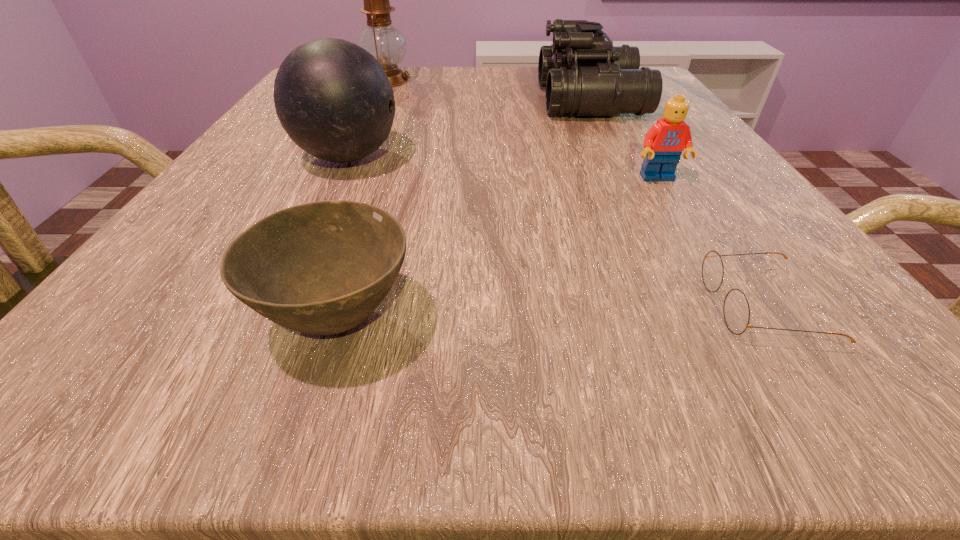
Identify the location of free space between the tallest object and the shortest object. (574, 193).

This screenshot has width=960, height=540. What are the coordinates of `free space that is in between the bowling ball and the Lego` in the screenshot? It's located at (503, 168).

The height and width of the screenshot is (540, 960). I want to click on free area in between the Lego and the fifth tallest object, so click(x=497, y=248).

Identify the location of free spot between the shortest object and the fifth shortest object. The width and height of the screenshot is (960, 540). (555, 231).

Identify which object is the second nearest to the bowl. Please provide its 2D coordinates. Your answer should be formatted as a tuple, i.e. [(x, y)], where the tuple contains the x and y coordinates of a point satisfying the conditions above.

[(736, 310)]

Locate which object is the fourth closest to the binoculars. Please provide its 2D coordinates. Your answer should be formatted as a tuple, i.e. [(x, y)], where the tuple contains the x and y coordinates of a point satisfying the conditions above.

[(736, 310)]

Where is `blank area in the image that satisfies the following two spatial constraints: 1. on the grip area of the bowling ball; 2. on the left side of the second shortest object`? Image resolution: width=960 pixels, height=540 pixels. blank area in the image that satisfies the following two spatial constraints: 1. on the grip area of the bowling ball; 2. on the left side of the second shortest object is located at coordinates [x=272, y=318].